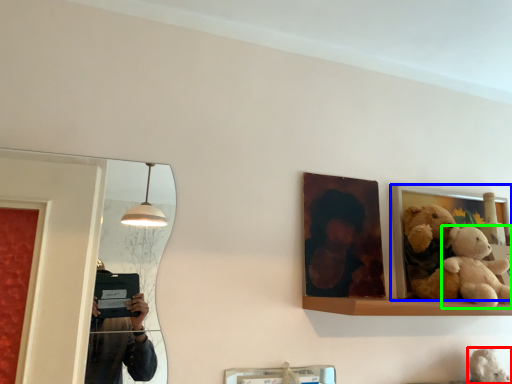
Question: Based on their relative distances, which object is farther from teddy (highlighted by a red box)? Choose from picture frame (highlighted by a blue box) and teddy bear (highlighted by a green box).

Choices:
 (A) picture frame
 (B) teddy bear

Answer: (A)